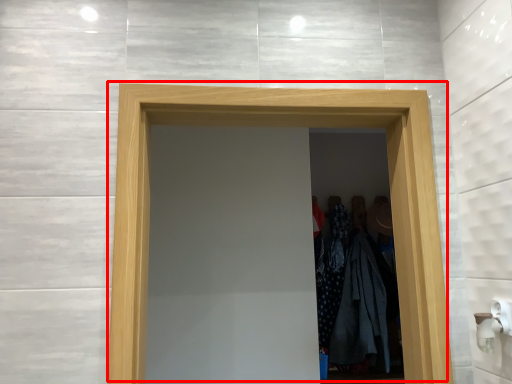
Question: Considering the relative positions of door (annotated by the red box) and clothing in the image provided, where is door (annotated by the red box) located with respect to the staircase?

Choices:
 (A) right
 (B) left

Answer: (B)